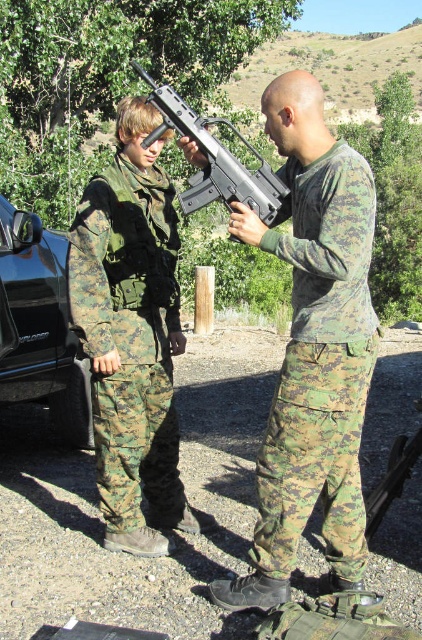
Question: Is camouflage fabric pants at center to the right of black glossy car at left from the viewer's perspective?

Choices:
 (A) yes
 (B) no

Answer: (A)

Question: Is camouflage fabric pants at center below camouflage fabric uniform at left?

Choices:
 (A) no
 (B) yes

Answer: (B)

Question: Does camouflage fabric uniform at left have a greater width compared to black glossy car at left?

Choices:
 (A) no
 (B) yes

Answer: (B)

Question: Which point appears farthest from the camera in this image?

Choices:
 (A) (232, 240)
 (B) (45, 321)
 (C) (172, 408)

Answer: (B)

Question: Which point is farther to the camera?

Choices:
 (A) (235, 188)
 (B) (59, 358)
 (C) (351, 424)

Answer: (B)

Question: Which of these objects is positioned closest to the camouflage fabric uniform at left?

Choices:
 (A) metallic gray rifle at center
 (B) black glossy car at left
 (C) camouflage fabric pants at center

Answer: (A)